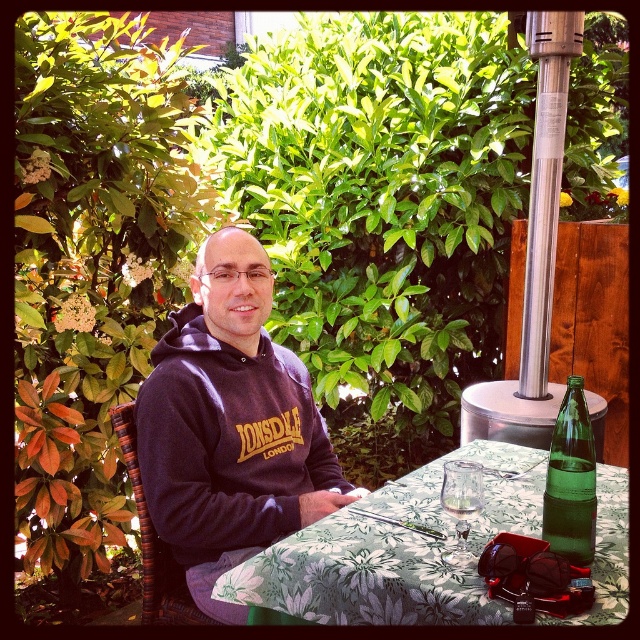
What is the object located at the coordinates point (396, 552)?

The object located at point (396, 552) is the floral fabric table at center.

You are setting up a picnic and need to place a large salad bowl on the table. The salad bowl is the same size as the floral fabric table at center. Will it fit on the clear glass wine glass at table center?

The floral fabric table at center is bigger than the clear glass wine glass at table center. Since the salad bowl is the same size as the table, it will not fit on the glass wine glass because the glass is smaller.